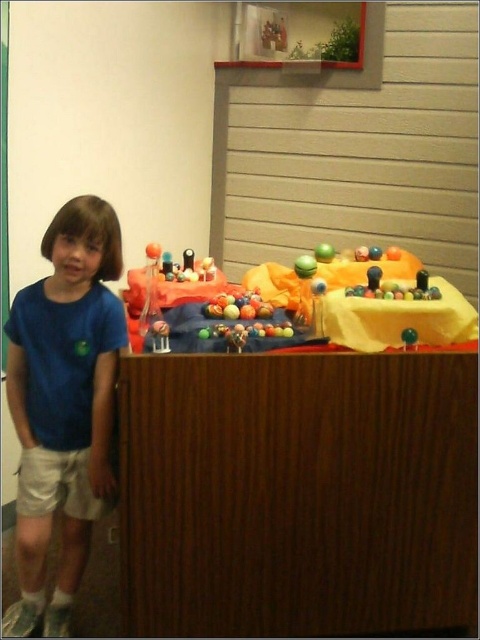
Question: Can you confirm if shiny metallic balls at center is thinner than glossy plastic balls at center?

Choices:
 (A) yes
 (B) no

Answer: (B)

Question: Does white cotton shorts at lower left lie behind shiny metallic balls at center?

Choices:
 (A) yes
 (B) no

Answer: (B)

Question: Can you confirm if shiny metallic balls at center is positioned below glossy plastic balls at center?

Choices:
 (A) yes
 (B) no

Answer: (B)

Question: Which of these objects is positioned farthest from the glossy plastic balls at center?

Choices:
 (A) wooden table at center
 (B) shiny metallic balls at center
 (C) blue cotton shirt at left

Answer: (C)

Question: Estimate the real-world distances between objects in this image. Which object is closer to the wooden table at center?

Choices:
 (A) blue cotton shirt at left
 (B) white cotton shorts at lower left
 (C) glossy plastic balls at center
 (D) shiny metallic balls at center

Answer: (A)

Question: Which of the following is the closest to the observer?

Choices:
 (A) glossy plastic balls at center
 (B) shiny metallic balls at center
 (C) blue cotton shirt at left
 (D) wooden table at center

Answer: (D)